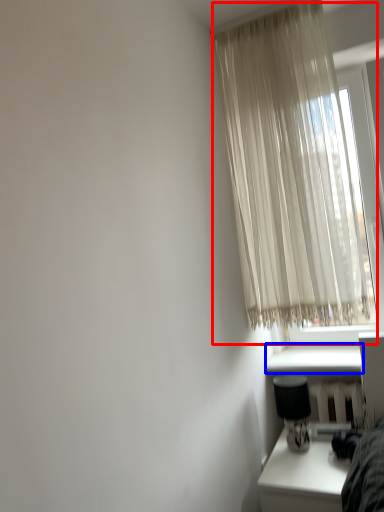
Question: Which object is further to the camera taking this photo, curtain (highlighted by a red box) or window sill (highlighted by a blue box)?

Choices:
 (A) curtain
 (B) window sill

Answer: (B)